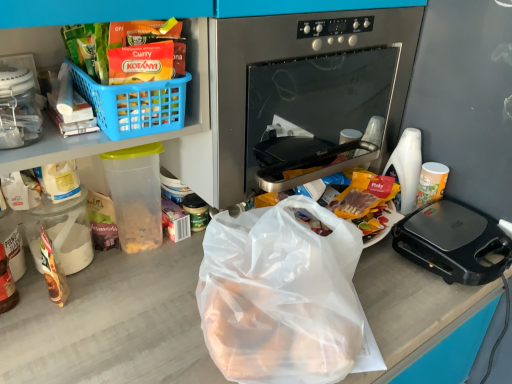
The image size is (512, 384). What do you see at coordinates (431, 182) in the screenshot? I see `white glossy cup at right, which ranks as the second coffee cup in left-to-right order` at bounding box center [431, 182].

The image size is (512, 384). What are the coordinates of `white glossy cup at right, marked as the first coffee cup in a right-to-left arrangement` in the screenshot? It's located at (431, 182).

Describe the element at coordinates (307, 85) in the screenshot. I see `stainless steel oven at center` at that location.

The height and width of the screenshot is (384, 512). Describe the element at coordinates (407, 167) in the screenshot. I see `white plastic cup at right, which is the second coffee cup from right to left` at that location.

At what (x,y) coordinates should I click in order to perform the action: click on white glossy cup at right, marked as the first coffee cup in a right-to-left arrangement. Please return your answer as a coordinate pair (x, y). Looking at the image, I should click on (431, 182).

Which is closer to the camera, [120,136] or [419,141]?

Point [120,136] is closer to the camera than point [419,141].

Find the location of a particular element. basket lying above the white plastic cup at right, which is the second coffee cup from right to left (from the image's perspective) is located at coordinates (134, 104).

Considering the relative positions of blue plastic basket at upper left and white plastic cup at right, which ranks as the 1th coffee cup in left-to-right order, in the image provided, is blue plastic basket at upper left to the left of white plastic cup at right, which ranks as the 1th coffee cup in left-to-right order, from the viewer's perspective?

Correct, you'll find blue plastic basket at upper left to the left of white plastic cup at right, which ranks as the 1th coffee cup in left-to-right order.

Between black plastic sandwich maker at right and stainless steel oven at center, which one has smaller size?

With smaller size is black plastic sandwich maker at right.

Considering the positions of point (469, 254) and point (267, 29), is point (469, 254) closer or farther from the camera than point (267, 29)?

Point (469, 254) is farther from the camera than point (267, 29).

From the image's perspective, is black plastic sandwich maker at right over stainless steel oven at center?

Incorrect, from the image's perspective, black plastic sandwich maker at right is lower than stainless steel oven at center.

Which object is more forward, stainless steel oven at center or white plastic cup at right, which is the second coffee cup from right to left?

stainless steel oven at center is closer to the camera.

Would you say stainless steel oven at center is to the left or to the right of white plastic cup at right, which is the second coffee cup from right to left, in the picture?

In the image, stainless steel oven at center appears on the left side of white plastic cup at right, which is the second coffee cup from right to left.

Identify the location of oven above the white plastic cup at right, which is the second coffee cup from right to left (from a real-world perspective). (307, 85).

Considering the points (317, 113) and (407, 144), which point is behind, point (317, 113) or point (407, 144)?

The point (407, 144) is farther from the camera.

Which of these two, white glossy cup at right, which ranks as the second coffee cup in left-to-right order, or black plastic sandwich maker at right, stands taller?

With more height is white glossy cup at right, which ranks as the second coffee cup in left-to-right order.

Which is correct: white glossy cup at right, marked as the first coffee cup in a right-to-left arrangement, is inside black plastic sandwich maker at right, or outside of it?

white glossy cup at right, marked as the first coffee cup in a right-to-left arrangement, lies outside black plastic sandwich maker at right.

Which is more to the right, white glossy cup at right, which ranks as the second coffee cup in left-to-right order, or black plastic sandwich maker at right?

Positioned to the right is black plastic sandwich maker at right.

Considering the sizes of objects blue plastic basket at upper left and stainless steel oven at center in the image provided, who is wider, blue plastic basket at upper left or stainless steel oven at center?

stainless steel oven at center is wider.

Is blue plastic basket at upper left looking in the opposite direction of stainless steel oven at center?

No, blue plastic basket at upper left is not facing the opposite direction of stainless steel oven at center.

Which of these two, blue plastic basket at upper left or stainless steel oven at center, stands shorter?

blue plastic basket at upper left.

Which is correct: white plastic cup at right, which is the second coffee cup from right to left, is inside stainless steel oven at center, or outside of it?

white plastic cup at right, which is the second coffee cup from right to left, exists outside the volume of stainless steel oven at center.

Which object is thinner, white plastic cup at right, which ranks as the 1th coffee cup in left-to-right order, or stainless steel oven at center?

With smaller width is white plastic cup at right, which ranks as the 1th coffee cup in left-to-right order.

In the image, is white plastic cup at right, which ranks as the 1th coffee cup in left-to-right order, positioned in front of or behind stainless steel oven at center?

white plastic cup at right, which ranks as the 1th coffee cup in left-to-right order, is behind stainless steel oven at center.

Is white glossy cup at right, marked as the first coffee cup in a right-to-left arrangement, outside of blue plastic basket at upper left?

Absolutely, white glossy cup at right, marked as the first coffee cup in a right-to-left arrangement, is external to blue plastic basket at upper left.

Considering the positions of objects white glossy cup at right, which ranks as the second coffee cup in left-to-right order, and blue plastic basket at upper left in the image provided, who is more to the right, white glossy cup at right, which ranks as the second coffee cup in left-to-right order, or blue plastic basket at upper left?

white glossy cup at right, which ranks as the second coffee cup in left-to-right order.

From the picture: Is white glossy cup at right, which ranks as the second coffee cup in left-to-right order, facing towards blue plastic basket at upper left?

No, white glossy cup at right, which ranks as the second coffee cup in left-to-right order, is not oriented towards blue plastic basket at upper left.

Between white glossy cup at right, which ranks as the second coffee cup in left-to-right order, and blue plastic basket at upper left, which one has smaller width?

white glossy cup at right, which ranks as the second coffee cup in left-to-right order.

Identify the location of basket above the white plastic cup at right, which ranks as the 1th coffee cup in left-to-right order (from a real-world perspective). (134, 104).

The image size is (512, 384). Find the location of `kitchen appliance below the stainless steel oven at center (from a real-world perspective)`. kitchen appliance below the stainless steel oven at center (from a real-world perspective) is located at coordinates (454, 242).

Estimate the real-world distances between objects in this image. Which object is further from white glossy cup at right, which ranks as the second coffee cup in left-to-right order, stainless steel oven at center or white plastic cup at right, which is the second coffee cup from right to left?

stainless steel oven at center.

Looking at the image, which one is located further to white glossy cup at right, which ranks as the second coffee cup in left-to-right order, black plastic sandwich maker at right or blue plastic basket at upper left?

blue plastic basket at upper left is further to white glossy cup at right, which ranks as the second coffee cup in left-to-right order.

Which object lies further to the anchor point white plastic cup at right, which is the second coffee cup from right to left, stainless steel oven at center or black plastic sandwich maker at right?

Among the two, stainless steel oven at center is located further to white plastic cup at right, which is the second coffee cup from right to left.

When comparing their distances from black plastic sandwich maker at right, does white plastic cup at right, which is the second coffee cup from right to left, or white glossy cup at right, which ranks as the second coffee cup in left-to-right order, seem closer?

Among the two, white glossy cup at right, which ranks as the second coffee cup in left-to-right order, is located nearer to black plastic sandwich maker at right.

Considering their positions, is black plastic sandwich maker at right positioned closer to white plastic cup at right, which ranks as the 1th coffee cup in left-to-right order, than stainless steel oven at center?

black plastic sandwich maker at right is positioned closer to the anchor white plastic cup at right, which ranks as the 1th coffee cup in left-to-right order.

Consider the image. From the image, which object appears to be farther from blue plastic basket at upper left, stainless steel oven at center or black plastic sandwich maker at right?

black plastic sandwich maker at right is positioned further to the anchor blue plastic basket at upper left.

From the picture: Based on their spatial positions, is blue plastic basket at upper left or black plastic sandwich maker at right closer to stainless steel oven at center?

The object closer to stainless steel oven at center is black plastic sandwich maker at right.

From the image, which object appears to be farther from stainless steel oven at center, white glossy cup at right, marked as the first coffee cup in a right-to-left arrangement, or black plastic sandwich maker at right?

white glossy cup at right, marked as the first coffee cup in a right-to-left arrangement.

This screenshot has height=384, width=512. Identify the location of oven located between blue plastic basket at upper left and white glossy cup at right, marked as the first coffee cup in a right-to-left arrangement, in the left-right direction. (307, 85).

Identify the location of coffee cup located between stainless steel oven at center and white plastic cup at right, which ranks as the 1th coffee cup in left-to-right order, in the depth direction. The width and height of the screenshot is (512, 384). (431, 182).

Locate an element on the screen. The height and width of the screenshot is (384, 512). coffee cup between black plastic sandwich maker at right and white plastic cup at right, which is the second coffee cup from right to left, from front to back is located at coordinates (431, 182).

The image size is (512, 384). In order to click on oven between blue plastic basket at upper left and black plastic sandwich maker at right in this screenshot , I will do `click(307, 85)`.